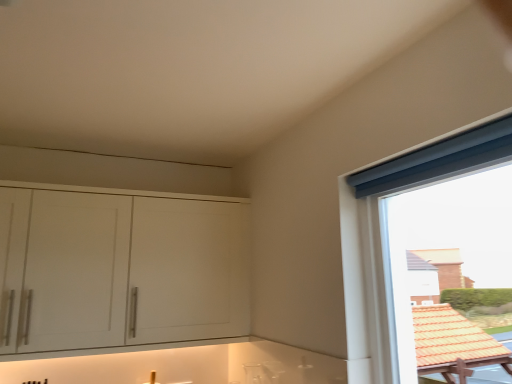
Where is `blue fabric curtain at upper right`? Image resolution: width=512 pixels, height=384 pixels. blue fabric curtain at upper right is located at coordinates (435, 250).

What do you see at coordinates (435, 250) in the screenshot? The height and width of the screenshot is (384, 512). I see `blue fabric curtain at upper right` at bounding box center [435, 250].

What do you see at coordinates (119, 270) in the screenshot?
I see `white matte cabinet at left` at bounding box center [119, 270].

Locate an element on the screen. This screenshot has width=512, height=384. white matte cabinet at left is located at coordinates [119, 270].

I want to click on blue fabric curtain at upper right, so click(435, 250).

Does blue fabric curtain at upper right appear on the left side of white matte cabinet at left?

No.

Considering their positions, is blue fabric curtain at upper right located in front of or behind white matte cabinet at left?

Clearly, blue fabric curtain at upper right is in front of white matte cabinet at left.

Considering the positions of points (436, 315) and (56, 219), is point (436, 315) closer to camera compared to point (56, 219)?

That is True.

From the image's perspective, relative to white matte cabinet at left, is blue fabric curtain at upper right above or below?

Based on their image positions, blue fabric curtain at upper right is located above white matte cabinet at left.

From a real-world perspective, between blue fabric curtain at upper right and white matte cabinet at left, who is vertically higher?

white matte cabinet at left.

Is blue fabric curtain at upper right thinner than white matte cabinet at left?

Yes, blue fabric curtain at upper right is thinner than white matte cabinet at left.

Consider the image. Does blue fabric curtain at upper right have a greater height compared to white matte cabinet at left?

Correct, blue fabric curtain at upper right is much taller as white matte cabinet at left.

Considering the relative sizes of blue fabric curtain at upper right and white matte cabinet at left in the image provided, is blue fabric curtain at upper right bigger than white matte cabinet at left?

No, blue fabric curtain at upper right is not bigger than white matte cabinet at left.

Is blue fabric curtain at upper right outside of white matte cabinet at left?

That's correct, blue fabric curtain at upper right is outside of white matte cabinet at left.

Is blue fabric curtain at upper right next to white matte cabinet at left and touching it?

blue fabric curtain at upper right is not next to white matte cabinet at left, and they're not touching.

Is blue fabric curtain at upper right looking in the opposite direction of white matte cabinet at left?

No, blue fabric curtain at upper right is not facing the opposite direction of white matte cabinet at left.

What's the angular difference between blue fabric curtain at upper right and white matte cabinet at left's facing directions?

There is a 89.9-degree angle between the facing directions of blue fabric curtain at upper right and white matte cabinet at left.

From the picture: How much distance is there between blue fabric curtain at upper right and white matte cabinet at left?

1.12 meters.

In order to click on window that is on the right side of white matte cabinet at left in this screenshot , I will do `click(435, 250)`.

Does white matte cabinet at left appear on the left side of blue fabric curtain at upper right?

Correct, you'll find white matte cabinet at left to the left of blue fabric curtain at upper right.

Is white matte cabinet at left positioned behind blue fabric curtain at upper right?

Yes, it is behind blue fabric curtain at upper right.

Is point (188, 244) farther from camera compared to point (434, 163)?

That is True.

From the image's perspective, is white matte cabinet at left under blue fabric curtain at upper right?

Indeed, from the image's perspective, white matte cabinet at left is shown beneath blue fabric curtain at upper right.

From a real-world perspective, who is located lower, white matte cabinet at left or blue fabric curtain at upper right?

blue fabric curtain at upper right.

Which object is wider, white matte cabinet at left or blue fabric curtain at upper right?

Wider between the two is white matte cabinet at left.

From the picture: Considering the relative sizes of white matte cabinet at left and blue fabric curtain at upper right in the image provided, is white matte cabinet at left taller than blue fabric curtain at upper right?

No, white matte cabinet at left is not taller than blue fabric curtain at upper right.

Which of these two, white matte cabinet at left or blue fabric curtain at upper right, is bigger?

With larger size is white matte cabinet at left.

Is blue fabric curtain at upper right surrounded by white matte cabinet at left?

No.

Is white matte cabinet at left touching blue fabric curtain at upper right?

No.

Is white matte cabinet at left facing away from blue fabric curtain at upper right?

No, white matte cabinet at left is not facing the opposite direction of blue fabric curtain at upper right.

How different are the orientations of white matte cabinet at left and blue fabric curtain at upper right in degrees?

89.9 degrees separate the facing orientations of white matte cabinet at left and blue fabric curtain at upper right.

Measure the distance between white matte cabinet at left and blue fabric curtain at upper right.

3.67 feet.

Where is `window above the white matte cabinet at left (from the image's perspective)`? window above the white matte cabinet at left (from the image's perspective) is located at coordinates (435, 250).

This screenshot has width=512, height=384. I want to click on window in front of the white matte cabinet at left, so click(435, 250).

Where is `cabinetry that is behind the blue fabric curtain at upper right`? cabinetry that is behind the blue fabric curtain at upper right is located at coordinates (119, 270).